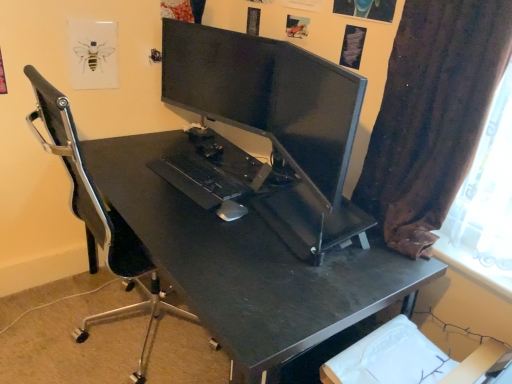
I want to click on vacant area that is situated to the right of white matte mouse at center, so click(258, 220).